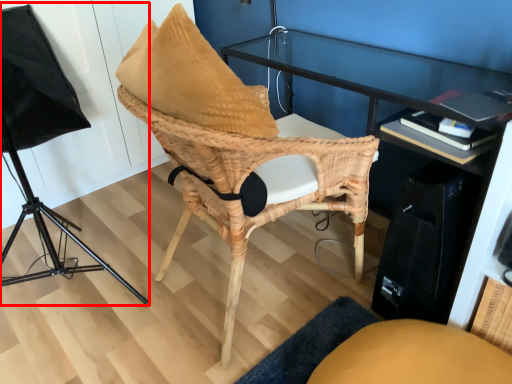
Question: Where is lamp (annotated by the red box) located in relation to chair in the image?

Choices:
 (A) right
 (B) left

Answer: (B)